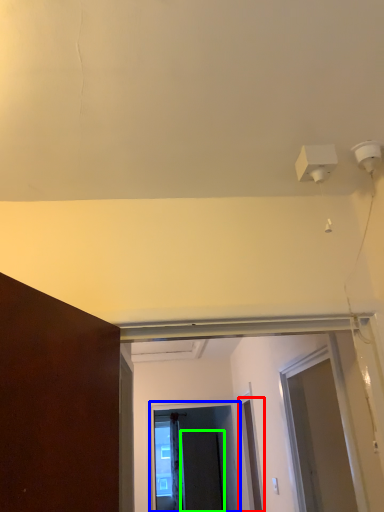
Question: Estimate the real-world distances between objects in this image. Which object is farther from door (highlighted by a red box), screen door (highlighted by a blue box) or screen door (highlighted by a green box)?

Choices:
 (A) screen door
 (B) screen door

Answer: (B)